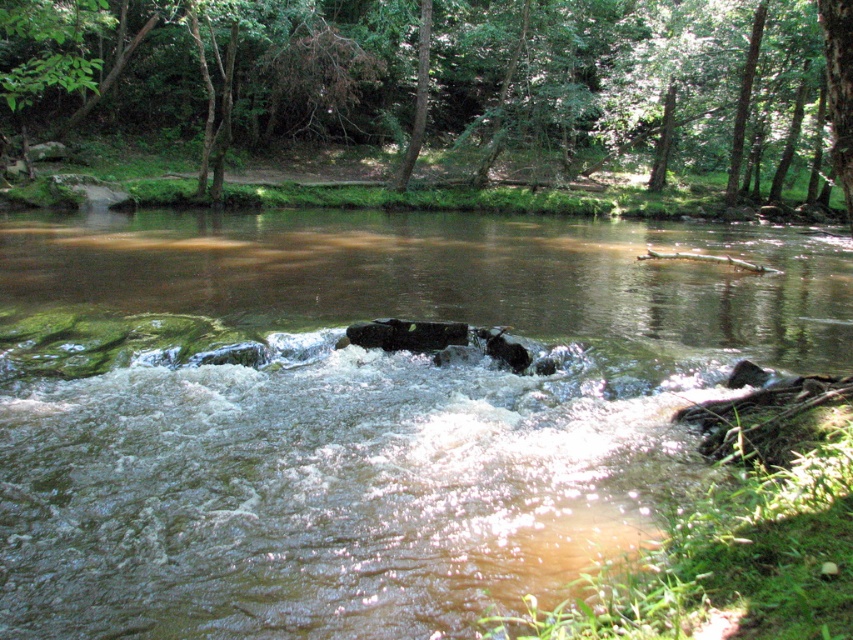
Measure the distance between brown smooth rock at center and green leafy tree at upper center.

A distance of 57.07 feet exists between brown smooth rock at center and green leafy tree at upper center.

Who is more forward, [329,388] or [544,145]?

Point [329,388]

Image resolution: width=853 pixels, height=640 pixels. What do you see at coordinates (358, 410) in the screenshot?
I see `brown smooth rock at center` at bounding box center [358, 410].

This screenshot has width=853, height=640. Identify the location of brown smooth rock at center. (358, 410).

Is brown smooth rock at center wider than green rough bark tree at upper center?

Indeed, brown smooth rock at center has a greater width compared to green rough bark tree at upper center.

Who is more distant from viewer, (53,364) or (426,52)?

The point (426,52) is behind.

Where is `brown smooth rock at center`? brown smooth rock at center is located at coordinates (358, 410).

Between point (180, 28) and point (416, 141), which one is positioned behind?

Positioned behind is point (180, 28).

Does green leafy tree at upper center have a larger size compared to green rough bark tree at upper center?

Indeed, green leafy tree at upper center has a larger size compared to green rough bark tree at upper center.

Is point (293, 6) closer to camera compared to point (428, 49)?

Yes, point (293, 6) is closer to viewer.

At what (x,y) coordinates should I click in order to perform the action: click on green leafy tree at upper center. Please return your answer as a coordinate pair (x, y). The height and width of the screenshot is (640, 853). Looking at the image, I should click on click(445, 77).